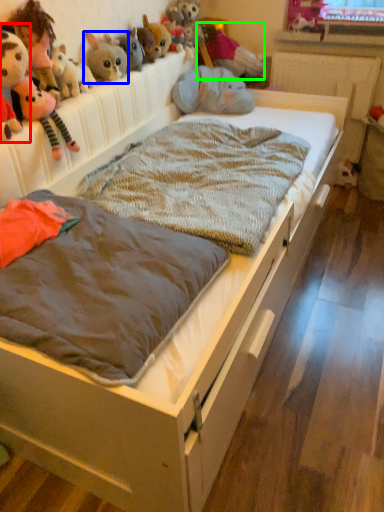
Question: Based on their relative distances, which object is farther from toy (highlighted by a red box)? Choose from toy (highlighted by a blue box) and toy (highlighted by a green box).

Choices:
 (A) toy
 (B) toy

Answer: (B)